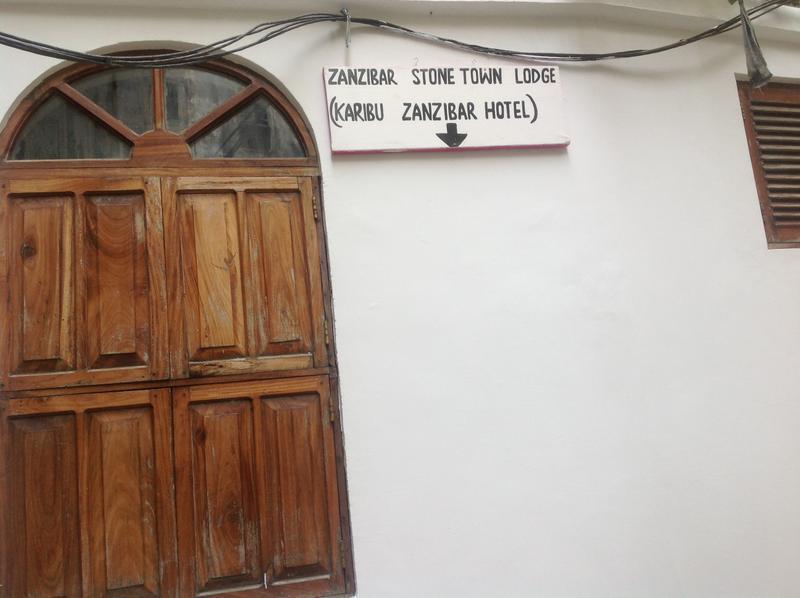
You are a GUI agent. You are given a task and a screenshot of the screen. Output one action in this format:
    pyautogui.click(x=<x>, y=<y>)
    Task: Click on the white wall
    The height and width of the screenshot is (598, 800).
    Given the screenshot: What is the action you would take?
    pyautogui.click(x=633, y=338)